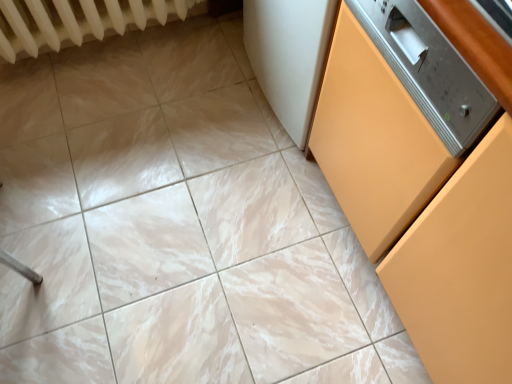
Question: Does matte orange cabinet at right have a smaller size compared to white textured radiator at upper left?

Choices:
 (A) no
 (B) yes

Answer: (A)

Question: Is matte orange cabinet at right thinner than white textured radiator at upper left?

Choices:
 (A) yes
 (B) no

Answer: (B)

Question: Would you consider matte orange cabinet at right to be distant from white textured radiator at upper left?

Choices:
 (A) yes
 (B) no

Answer: (A)

Question: Is the position of matte orange cabinet at right more distant than that of white textured radiator at upper left?

Choices:
 (A) no
 (B) yes

Answer: (A)

Question: From the image's perspective, is matte orange cabinet at right below white textured radiator at upper left?

Choices:
 (A) no
 (B) yes

Answer: (B)

Question: Does matte orange cabinet at right have a greater height compared to white textured radiator at upper left?

Choices:
 (A) yes
 (B) no

Answer: (A)

Question: Is white textured radiator at upper left at the right side of matte orange cabinet at right?

Choices:
 (A) no
 (B) yes

Answer: (A)

Question: Is white textured radiator at upper left far from matte orange cabinet at right?

Choices:
 (A) no
 (B) yes

Answer: (B)

Question: Is matte orange cabinet at right at the back of white textured radiator at upper left?

Choices:
 (A) no
 (B) yes

Answer: (A)

Question: Is white textured radiator at upper left wider than matte orange cabinet at right?

Choices:
 (A) yes
 (B) no

Answer: (B)

Question: Is white textured radiator at upper left positioned beyond the bounds of matte orange cabinet at right?

Choices:
 (A) yes
 (B) no

Answer: (A)

Question: Is white textured radiator at upper left aimed at matte orange cabinet at right?

Choices:
 (A) no
 (B) yes

Answer: (B)

Question: From the image's perspective, relative to white textured radiator at upper left, is matte orange cabinet at right above or below?

Choices:
 (A) below
 (B) above

Answer: (A)